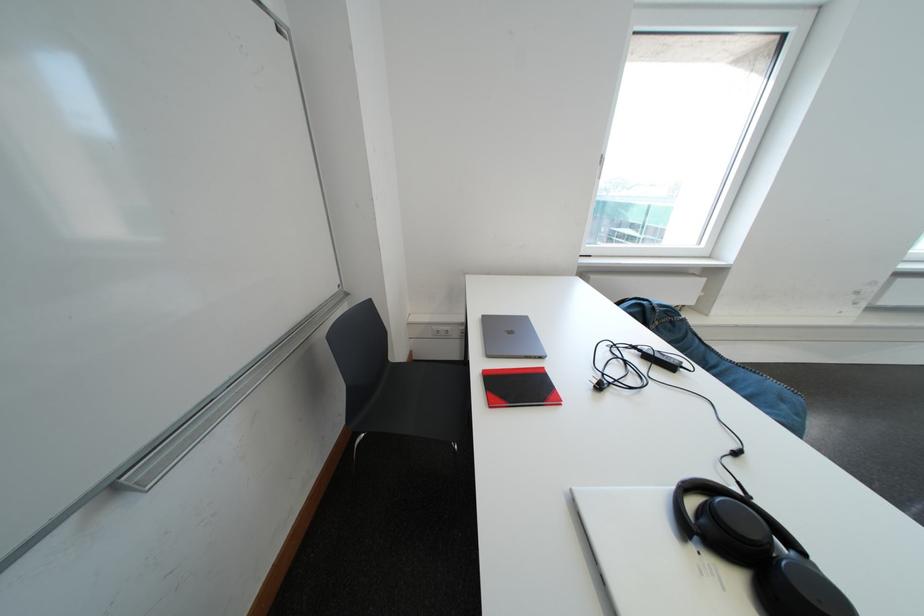
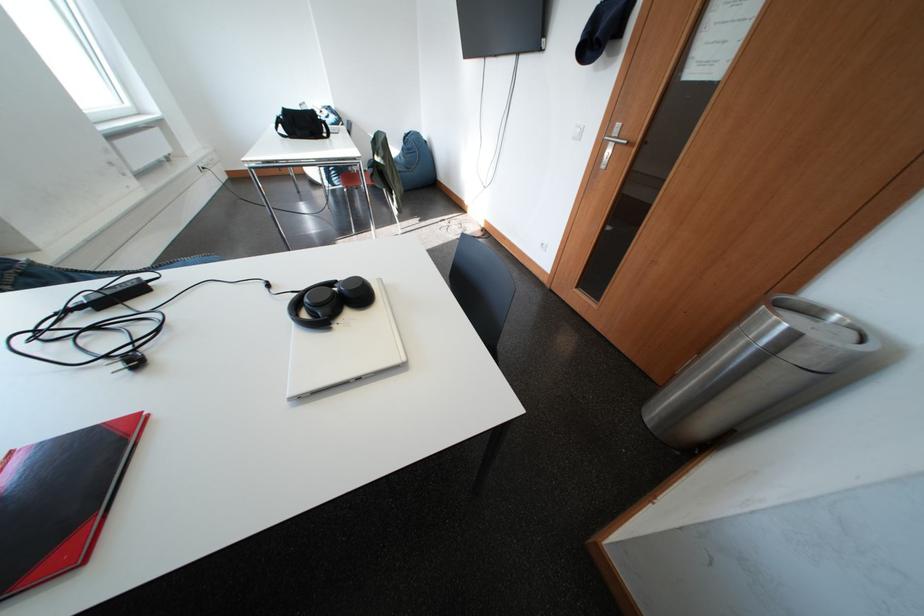
Where in the second image is the point corresponding to (746,582) from the first image?

(359, 318)